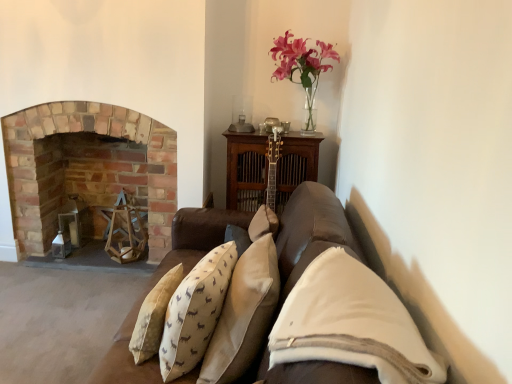
At what (x,y) coordinates should I click in order to perform the action: click on free location in front of brick fireplace at left. Please return your answer as a coordinate pair (x, y). Looking at the image, I should click on pyautogui.click(x=71, y=296).